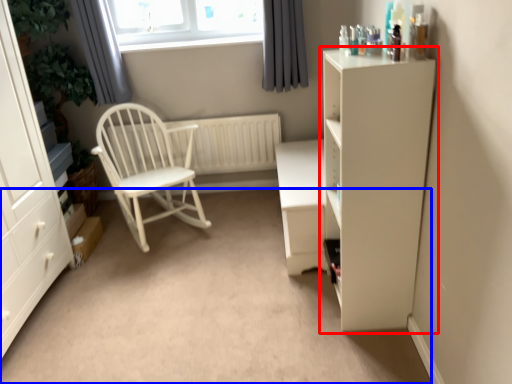
Question: Which object appears closest to the camera in this image, cupboard (highlighted by a red box) or plain (highlighted by a blue box)?

Choices:
 (A) cupboard
 (B) plain

Answer: (A)